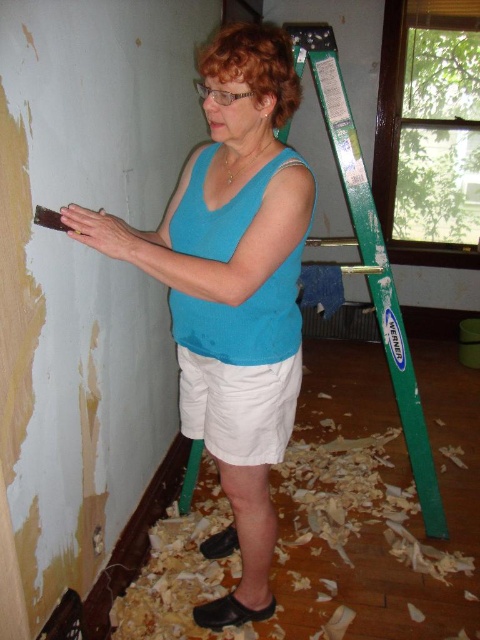
Between blue matte tank top at center and green plastic ladder at right, which one has more height?

Standing taller between the two is green plastic ladder at right.

Consider the image. Does blue matte tank top at center have a lesser height compared to green plastic ladder at right?

Yes, blue matte tank top at center is shorter than green plastic ladder at right.

What do you see at coordinates (232, 289) in the screenshot? This screenshot has height=640, width=480. I see `blue matte tank top at center` at bounding box center [232, 289].

What are the coordinates of `blue matte tank top at center` in the screenshot? It's located at (232, 289).

Is wooden shavings at lower center positioned at the back of green plastic ladder at right?

That is True.

Does point (324, 483) come closer to viewer compared to point (425, 429)?

That is False.

Image resolution: width=480 pixels, height=640 pixels. I want to click on wooden shavings at lower center, so click(x=313, y=552).

Is point (316, 627) more distant than point (250, 424)?

That is True.

Does wooden shavings at lower center appear on the right side of white cotton shorts at center?

Correct, you'll find wooden shavings at lower center to the right of white cotton shorts at center.

Image resolution: width=480 pixels, height=640 pixels. What do you see at coordinates (313, 552) in the screenshot? I see `wooden shavings at lower center` at bounding box center [313, 552].

Find the location of a particular element. The width and height of the screenshot is (480, 640). wooden shavings at lower center is located at coordinates (313, 552).